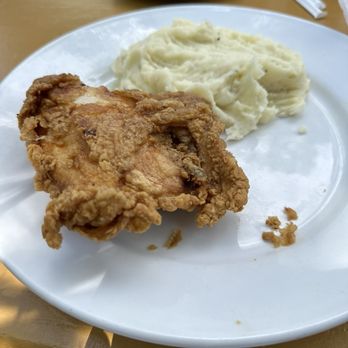
Find the location of a particular element. The image size is (348, 348). plate is located at coordinates (287, 179).